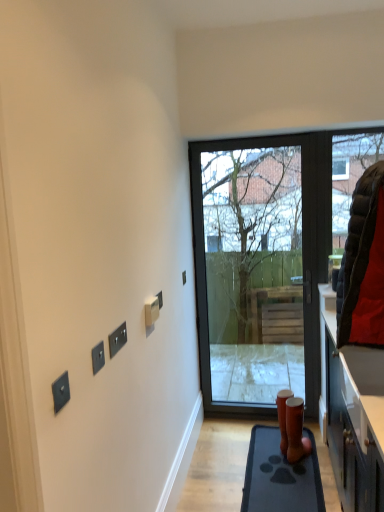
Question: Is matte black door at center in front of black plastic switch at center, which is the first electric outlet in right-to-left order?

Choices:
 (A) yes
 (B) no

Answer: (B)

Question: Is matte black door at center directly adjacent to black plastic switch at center, the fifth electric outlet from the front?

Choices:
 (A) yes
 (B) no

Answer: (B)

Question: Does matte black door at center appear on the left side of black plastic switch at center, arranged as the 1th electric outlet when viewed from the back?

Choices:
 (A) yes
 (B) no

Answer: (B)

Question: From a real-world perspective, is matte black door at center below black plastic switch at center, which is the 5th electric outlet in left-to-right order?

Choices:
 (A) yes
 (B) no

Answer: (A)

Question: Can you confirm if matte black door at center is wider than black plastic switch at center, the fifth electric outlet from the front?

Choices:
 (A) no
 (B) yes

Answer: (B)

Question: Does matte black door at center have a lesser width compared to black plastic switch at center, which is the first electric outlet in right-to-left order?

Choices:
 (A) no
 (B) yes

Answer: (A)

Question: Is satin black switch at lower left, the fifth electric outlet positioned from the right, a part of black quilted jacket at right?

Choices:
 (A) no
 (B) yes

Answer: (A)

Question: Is black quilted jacket at right touching satin black switch at lower left, positioned as the 1th electric outlet in front-to-back order?

Choices:
 (A) yes
 (B) no

Answer: (B)

Question: From a real-world perspective, does black quilted jacket at right stand above satin black switch at lower left, marked as the 5th electric outlet in a back-to-front arrangement?

Choices:
 (A) yes
 (B) no

Answer: (A)

Question: Is black quilted jacket at right located outside satin black switch at lower left, the fifth electric outlet positioned from the right?

Choices:
 (A) yes
 (B) no

Answer: (A)

Question: From a real-world perspective, is black quilted jacket at right positioned under satin black switch at lower left, placed as the first electric outlet when sorted from left to right, based on gravity?

Choices:
 (A) yes
 (B) no

Answer: (B)

Question: Does black quilted jacket at right have a larger size compared to satin black switch at lower left, marked as the 5th electric outlet in a back-to-front arrangement?

Choices:
 (A) no
 (B) yes

Answer: (B)

Question: From a real-world perspective, does matte black door at center sit lower than rubber mat at lower right?

Choices:
 (A) no
 (B) yes

Answer: (A)